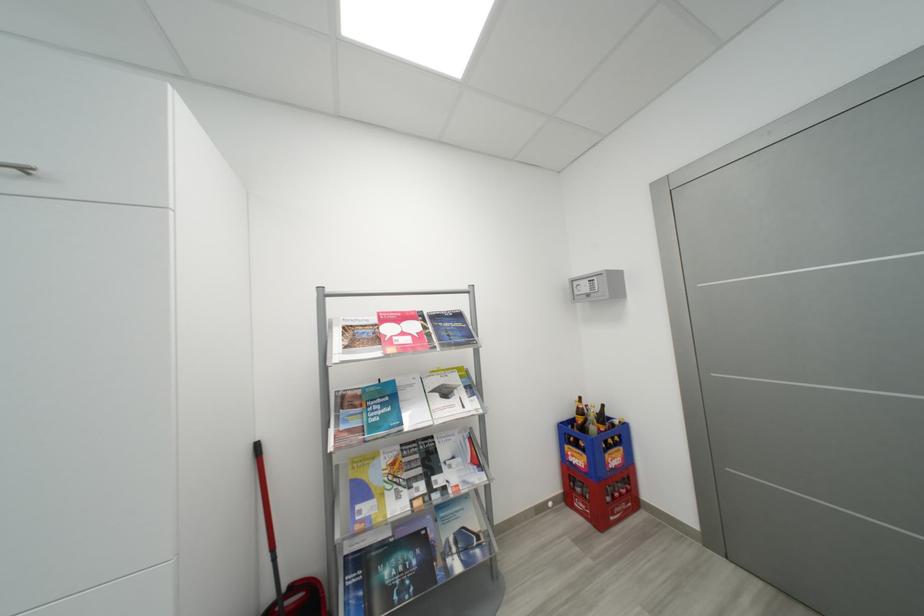
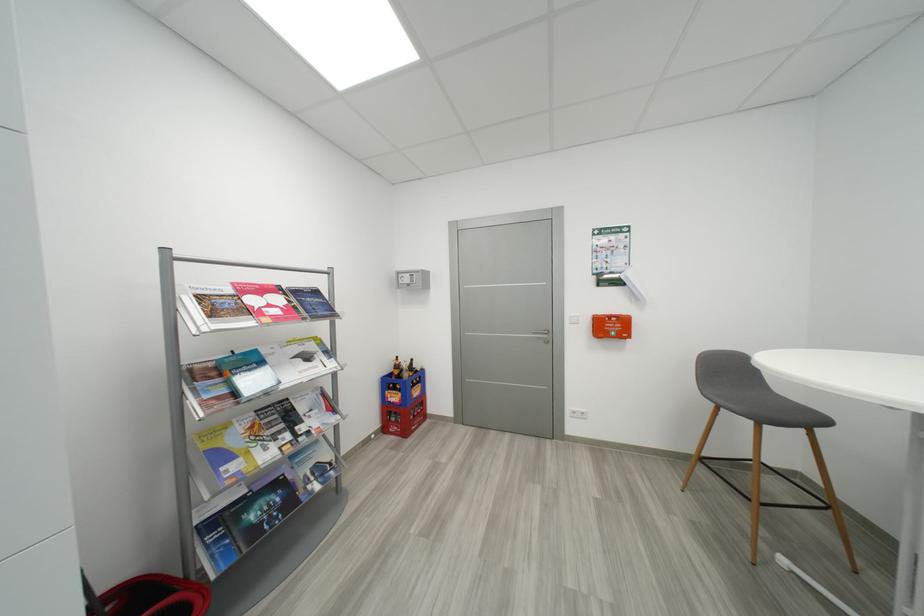
Find the pixel in the second image that matches pixel 453 394 in the first image.

(314, 359)